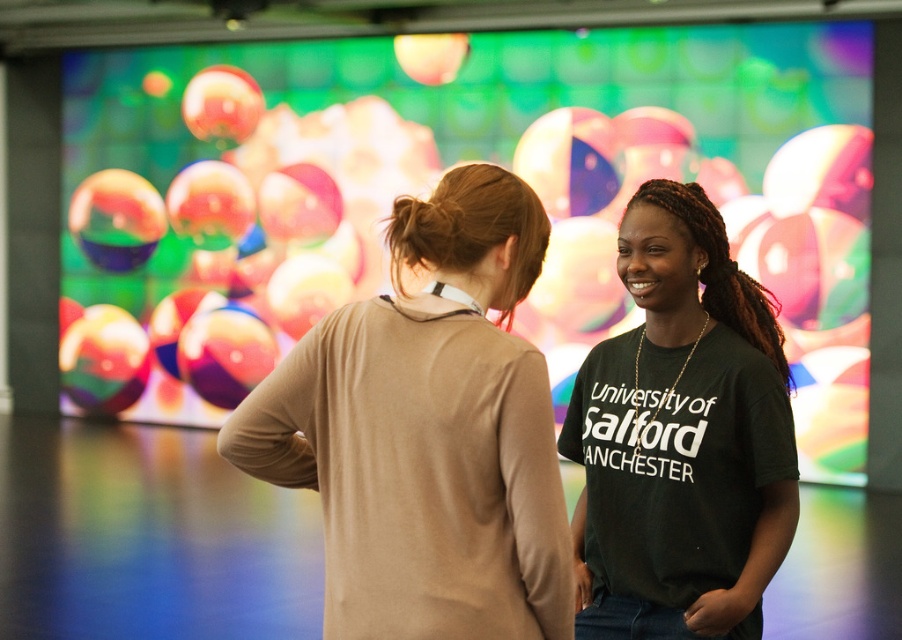
Question: Which object appears closest to the camera in this image?

Choices:
 (A) dark green t-shirt at center
 (B) matte beige sweater at center

Answer: (B)

Question: Is matte beige sweater at center wider than dark green t-shirt at center?

Choices:
 (A) no
 (B) yes

Answer: (B)

Question: Which point appears farthest from the camera in this image?

Choices:
 (A) (766, 561)
 (B) (407, 412)

Answer: (A)

Question: Does matte beige sweater at center appear on the right side of dark green t-shirt at center?

Choices:
 (A) no
 (B) yes

Answer: (A)

Question: Can you confirm if matte beige sweater at center is smaller than dark green t-shirt at center?

Choices:
 (A) yes
 (B) no

Answer: (A)